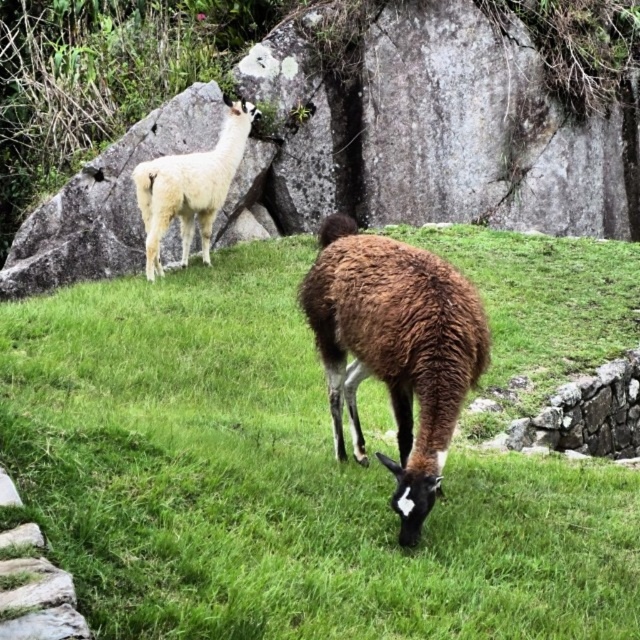
Can you confirm if brown woolen llama at center is wider than brown woolly alpaca at center?

Incorrect, brown woolen llama at center's width does not surpass brown woolly alpaca at center's.

Which is more to the right, brown woolen llama at center or brown woolly alpaca at center?

Positioned to the right is brown woolly alpaca at center.

What do you see at coordinates (275, 481) in the screenshot? I see `brown woolen llama at center` at bounding box center [275, 481].

Where is `brown woolen llama at center`? brown woolen llama at center is located at coordinates (275, 481).

Is brown woolly alpaca at center above white woolly alpaca at upper left?

Actually, brown woolly alpaca at center is below white woolly alpaca at upper left.

Identify the location of brown woolly alpaca at center. This screenshot has height=640, width=640. pyautogui.click(x=396, y=349).

In order to click on brown woolly alpaca at center in this screenshot , I will do `click(396, 349)`.

Is point (93, 461) positioned before point (248, 124)?

Yes.

Can you confirm if brown woolen llama at center is thinner than white woolly alpaca at upper left?

Yes.

Does point (435, 605) lie in front of point (147, 211)?

That is True.

Identify the location of brown woolen llama at center. (275, 481).